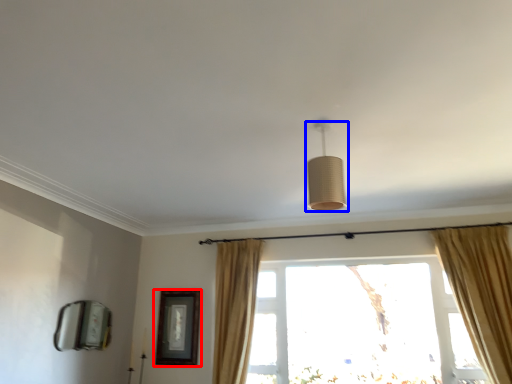
Question: Which object is closer to the camera taking this photo, picture frame (highlighted by a red box) or lamp (highlighted by a blue box)?

Choices:
 (A) picture frame
 (B) lamp

Answer: (B)